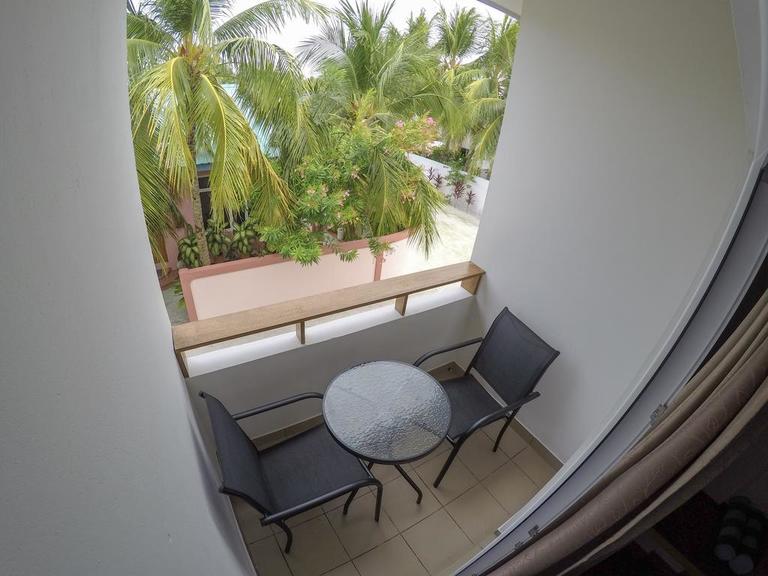
This screenshot has width=768, height=576. What are the coordinates of `window` in the screenshot? It's located at (207, 200).